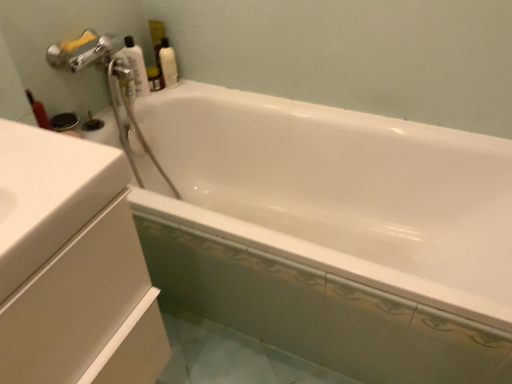
Question: Should I look upward or downward to see white glossy bottle at upper left, the first cleaning product positioned from the left?

Choices:
 (A) up
 (B) down

Answer: (A)

Question: Is white glossy bottle at upper right, placed as the second cleaning product when sorted from left to right, positioned far away from white glossy bottle at upper left, the first cleaning product positioned from the left?

Choices:
 (A) yes
 (B) no

Answer: (B)

Question: Considering the relative sizes of white glossy bottle at upper right, placed as the second cleaning product when sorted from left to right, and white glossy bottle at upper left, placed as the 2th cleaning product when sorted from right to left, in the image provided, is white glossy bottle at upper right, placed as the second cleaning product when sorted from left to right, thinner than white glossy bottle at upper left, placed as the 2th cleaning product when sorted from right to left,?

Choices:
 (A) no
 (B) yes

Answer: (B)

Question: Does white glossy bottle at upper right, placed as the second cleaning product when sorted from left to right, turn towards white glossy bottle at upper left, placed as the 2th cleaning product when sorted from right to left?

Choices:
 (A) yes
 (B) no

Answer: (B)

Question: Considering the relative sizes of white glossy bottle at upper right, placed as the second cleaning product when sorted from left to right, and white glossy bottle at upper left, placed as the 2th cleaning product when sorted from right to left, in the image provided, is white glossy bottle at upper right, placed as the second cleaning product when sorted from left to right, smaller than white glossy bottle at upper left, placed as the 2th cleaning product when sorted from right to left,?

Choices:
 (A) yes
 (B) no

Answer: (A)

Question: Considering the relative positions of white glossy bottle at upper right, placed as the second cleaning product when sorted from left to right, and white glossy bottle at upper left, placed as the 2th cleaning product when sorted from right to left, in the image provided, is white glossy bottle at upper right, placed as the second cleaning product when sorted from left to right, to the left of white glossy bottle at upper left, placed as the 2th cleaning product when sorted from right to left, from the viewer's perspective?

Choices:
 (A) yes
 (B) no

Answer: (B)

Question: Is white glossy bottle at upper right, placed as the second cleaning product when sorted from left to right, taller than white glossy bottle at upper left, placed as the 2th cleaning product when sorted from right to left?

Choices:
 (A) no
 (B) yes

Answer: (A)

Question: Does white glossy cabinet at left have a lesser width compared to white glossy bottle at upper right, placed as the second cleaning product when sorted from left to right?

Choices:
 (A) yes
 (B) no

Answer: (B)

Question: From the image's perspective, would you say white glossy cabinet at left is shown under white glossy bottle at upper right, placed as the second cleaning product when sorted from left to right?

Choices:
 (A) yes
 (B) no

Answer: (A)

Question: From the image's perspective, is white glossy cabinet at left located above white glossy bottle at upper right, placed as the second cleaning product when sorted from left to right?

Choices:
 (A) no
 (B) yes

Answer: (A)

Question: Can you confirm if white glossy cabinet at left is bigger than white glossy bottle at upper right, the 1th cleaning product in the right-to-left sequence?

Choices:
 (A) yes
 (B) no

Answer: (A)

Question: Can you confirm if white glossy cabinet at left is shorter than white glossy bottle at upper right, placed as the second cleaning product when sorted from left to right?

Choices:
 (A) no
 (B) yes

Answer: (A)

Question: From a real-world perspective, is white glossy cabinet at left beneath white glossy bottle at upper right, placed as the second cleaning product when sorted from left to right?

Choices:
 (A) yes
 (B) no

Answer: (A)

Question: Does white glossy bottle at upper left, placed as the 2th cleaning product when sorted from right to left, lie in front of white glossy bottle at upper right, the 1th cleaning product in the right-to-left sequence?

Choices:
 (A) yes
 (B) no

Answer: (A)